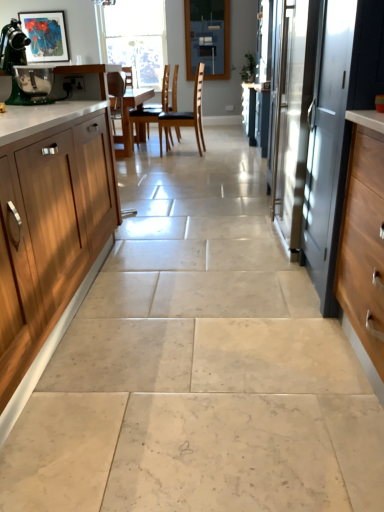
Question: From a real-world perspective, is green matte coffee machine at upper left above or below black leather chair at center, which is counted as the first chair, starting from the right?

Choices:
 (A) above
 (B) below

Answer: (A)

Question: In the image, is green matte coffee machine at upper left on the left side or the right side of black leather chair at center, placed as the 2th chair when sorted from left to right?

Choices:
 (A) left
 (B) right

Answer: (A)

Question: Estimate the real-world distances between objects in this image. Which object is closer to the blue glass window screen at upper center?

Choices:
 (A) satin silver screen door at right
 (B) black leather chair at center, which is counted as the first chair, starting from the right
 (C) green matte coffee machine at upper left
 (D) brown leather chair at center, the 2th chair positioned from the right
 (E) clear glass window at upper center

Answer: (B)

Question: Estimate the real-world distances between objects in this image. Which object is closer to the matte acrylic painting at upper left?

Choices:
 (A) blue glass window screen at upper center
 (B) clear glass window at upper center
 (C) black leather chair at center, which is counted as the first chair, starting from the right
 (D) satin silver screen door at right
 (E) brown leather chair at center, which is counted as the 1th chair, starting from the left

Answer: (D)